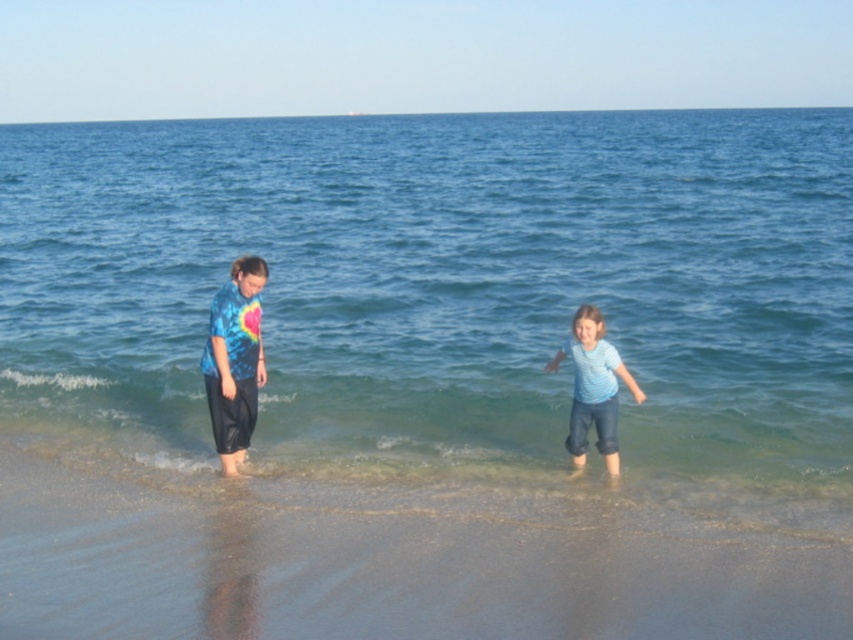
You are a photographer trying to capture the tie dye fabric pants at left in the image. The camera is positioned at the point with coordinates (234, 360). Where should you move the camera to focus on the pants?

The point at (234, 360) marks the tie dye fabric pants at left, so the camera is already positioned at the correct location to focus on them.